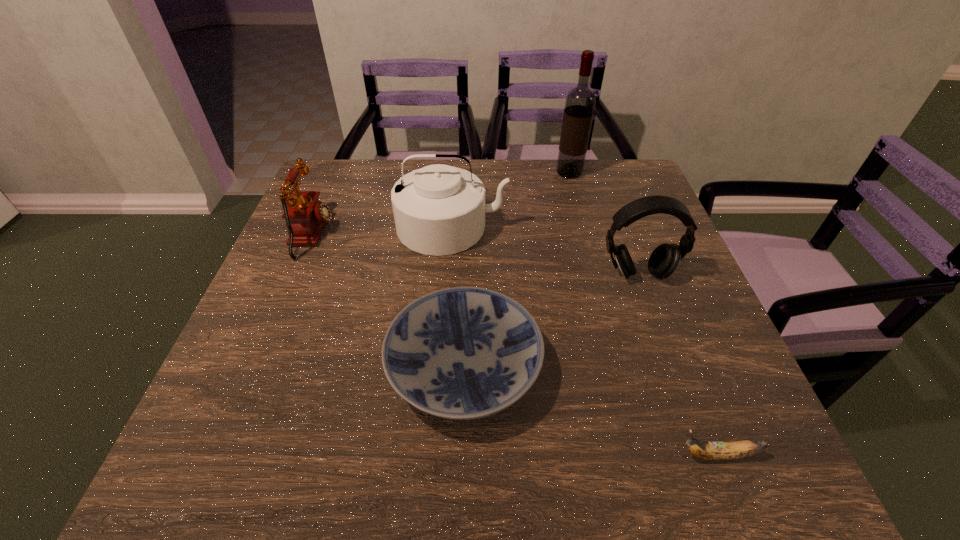
I want to click on wine bottle, so click(x=580, y=101).

Locate an element on the screen. the tallest object is located at coordinates (580, 101).

Identify the location of kettle. (439, 210).

I want to click on the fourth farthest object, so click(x=664, y=260).

You are a GUI agent. You are given a task and a screenshot of the screen. Output one action in this format:
    pyautogui.click(x=<x>, y=<y>)
    Task: Click on the telephone
    This screenshot has height=540, width=960.
    Given the screenshot: What is the action you would take?
    pyautogui.click(x=305, y=216)

Locate an element on the screen. The image size is (960, 540). the fourth tallest object is located at coordinates (305, 216).

Locate an element on the screen. The image size is (960, 540). the fifth farthest object is located at coordinates (463, 353).

Find the location of a particular element. the nearest object is located at coordinates pyautogui.click(x=738, y=449).

In order to click on vacant space located 0.130m on the front of the tallest object in this screenshot , I will do 578,206.

At what (x,y) coordinates should I click in order to perform the action: click on vacant space located 0.270m on the spout of the kettle. Please return your answer as a coordinate pair (x, y). The height and width of the screenshot is (540, 960). Looking at the image, I should click on (444, 349).